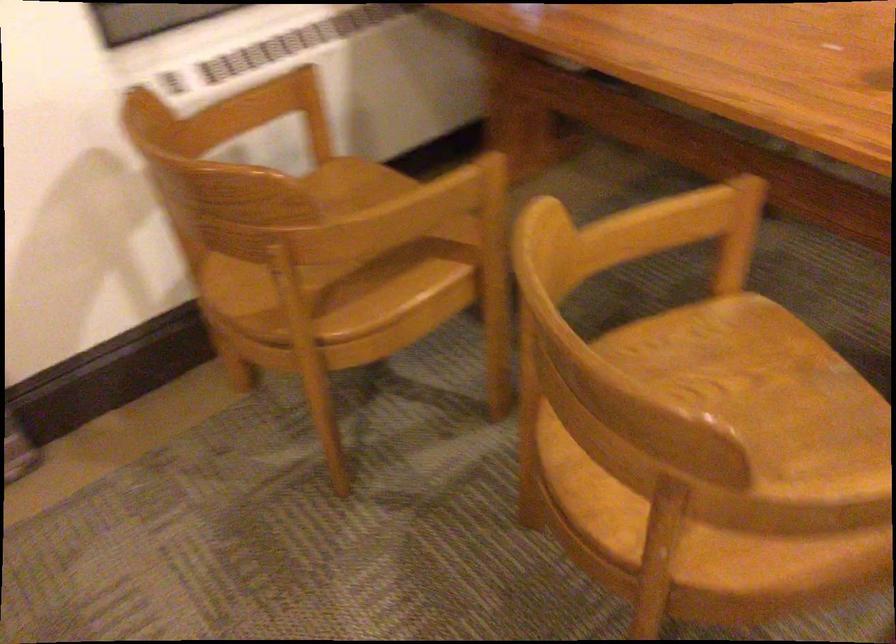
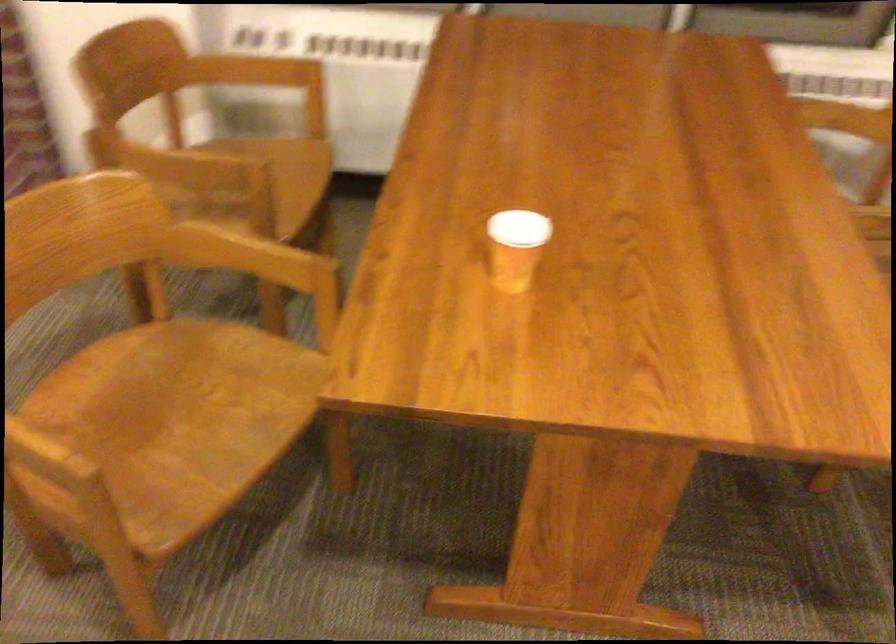
The point at (492, 185) is marked in the first image. Where is the corresponding point in the second image?

(252, 182)